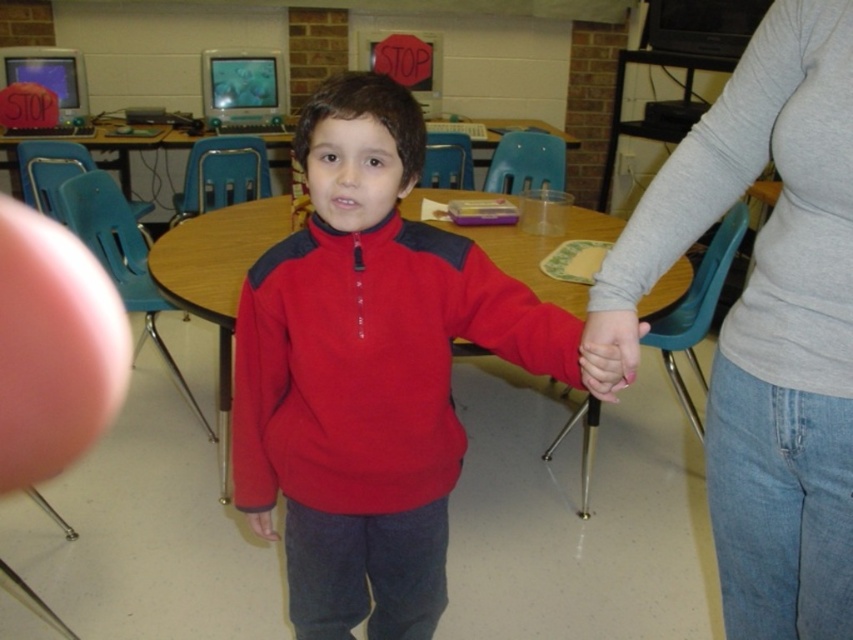
Question: Which point is farther to the camera?

Choices:
 (A) pink smooth skin at lower center
 (B) gray long-sleeve shirt at upper center
 (C) matte fleece sweater at center

Answer: (C)

Question: Where is gray long-sleeve shirt at upper center located in relation to pink smooth skin at lower center in the image?

Choices:
 (A) right
 (B) left

Answer: (A)

Question: Does gray long-sleeve shirt at upper center have a smaller size compared to pink smooth skin at lower center?

Choices:
 (A) yes
 (B) no

Answer: (B)

Question: Is matte fleece sweater at center thinner than pink smooth skin at lower center?

Choices:
 (A) no
 (B) yes

Answer: (A)

Question: Which object is the farthest from the matte fleece sweater at center?

Choices:
 (A) gray long-sleeve shirt at upper center
 (B) pink smooth skin at lower center

Answer: (A)

Question: Based on their relative distances, which object is farther from the matte fleece sweater at center?

Choices:
 (A) pink smooth skin at lower center
 (B) gray long-sleeve shirt at upper center

Answer: (B)